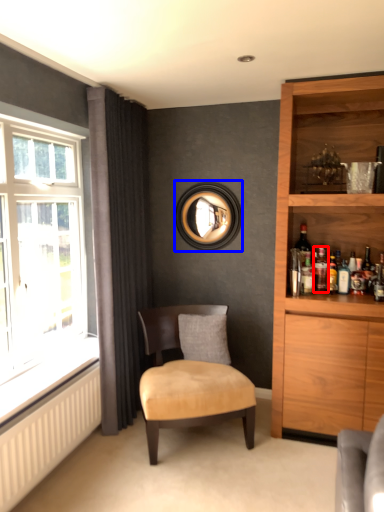
Question: Which object is further to the camera taking this photo, bottle (highlighted by a red box) or picture frame (highlighted by a blue box)?

Choices:
 (A) bottle
 (B) picture frame

Answer: (B)